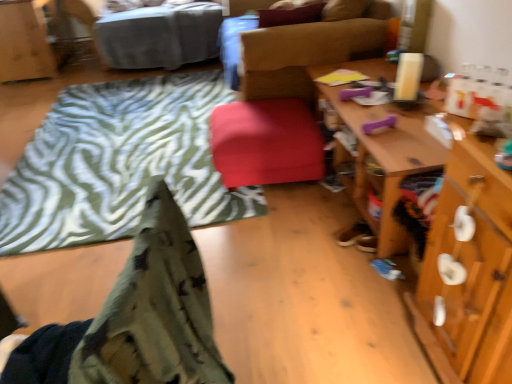
Question: From a real-world perspective, is soft green fleece blanket at lower left, the 2th blanket viewed from the back, positioned above or below velvet-like brown chair at center?

Choices:
 (A) above
 (B) below

Answer: (A)

Question: Is point tap(198, 367) positioned closer to the camera than point tap(296, 117)?

Choices:
 (A) closer
 (B) farther

Answer: (A)

Question: Estimate the real-world distances between objects in this image. Which object is closer to the soft green fleece blanket at lower left, positioned as the 1th blanket in front-to-back order?

Choices:
 (A) gray fabric bed at upper left
 (B) matte red stool at center
 (C) wooden cabinet at upper left
 (D) zebra-patterned fabric at lower left, the 2th blanket in the front-to-back sequence
 (E) wooden desk at right

Answer: (E)

Question: Which is nearer to the wooden cabinet at upper left?

Choices:
 (A) zebra-patterned fabric at lower left, the first blanket positioned from the back
 (B) matte red stool at center
 (C) velvet-like brown chair at center
 (D) gray fabric bed at upper left
 (E) soft green fleece blanket at lower left, the 2th blanket viewed from the back

Answer: (D)